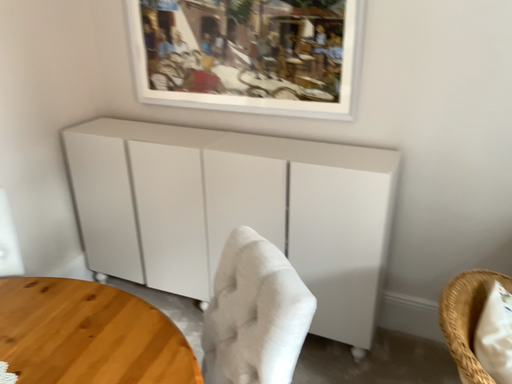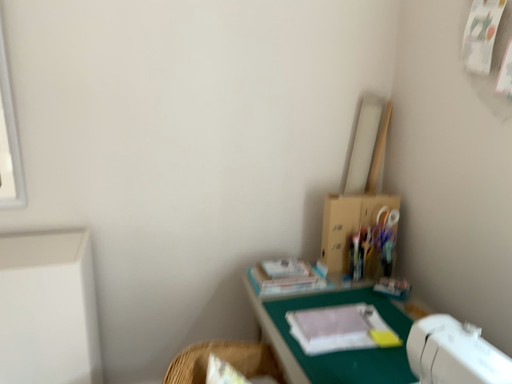
Question: How did the camera likely rotate when shooting the video?

Choices:
 (A) rotated right
 (B) rotated left

Answer: (A)